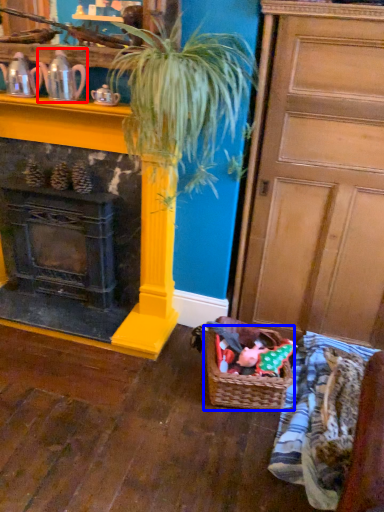
Question: Among these objects, which one is farthest to the camera, tea pot (highlighted by a red box) or basket (highlighted by a blue box)?

Choices:
 (A) tea pot
 (B) basket

Answer: (B)